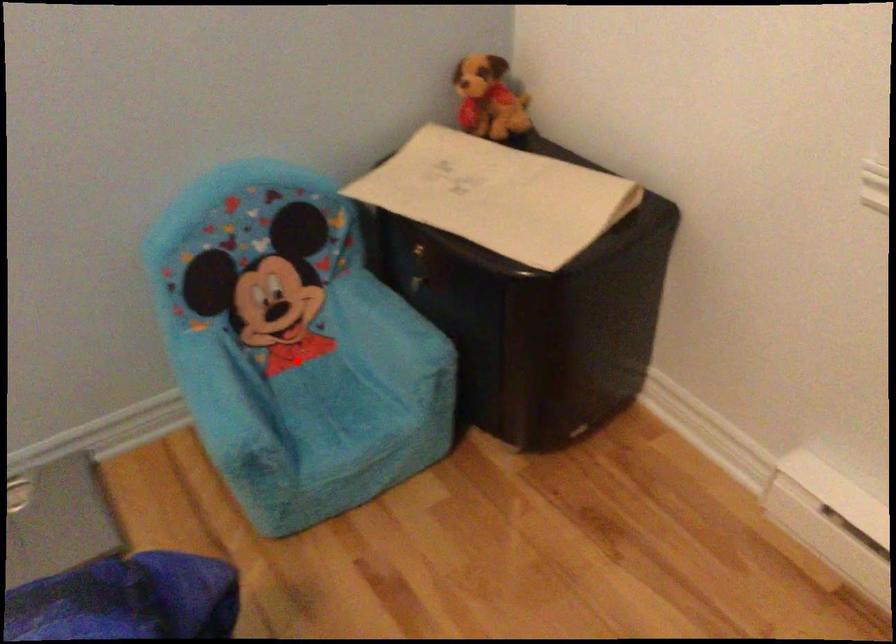
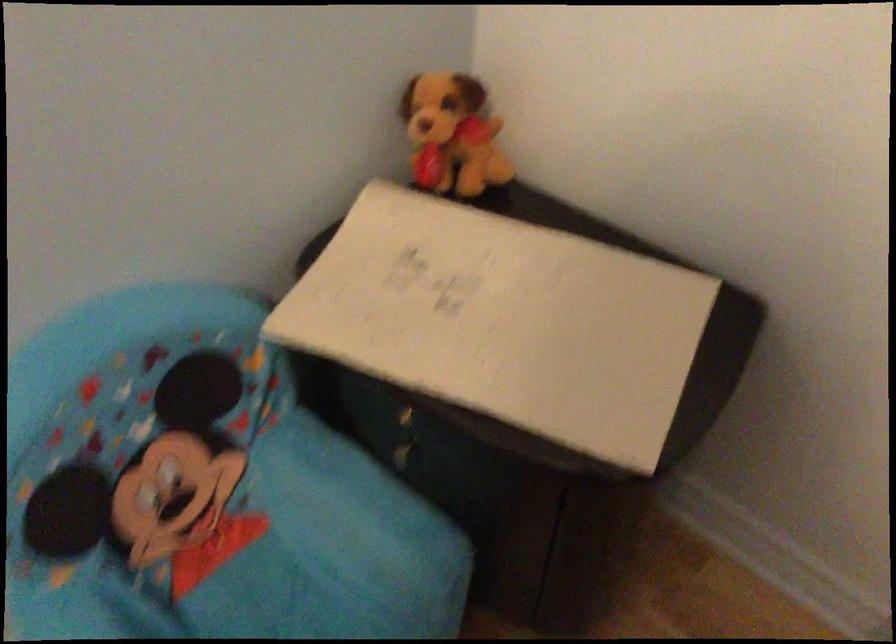
Locate, in the second image, the point that corresponds to the highlighted location in the first image.

(220, 554)